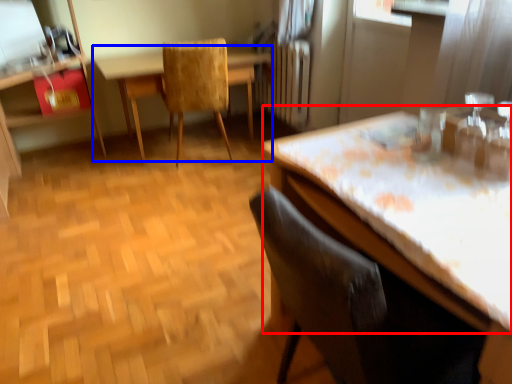
Question: Which object appears farthest to the camera in this image, counter top (highlighted by a red box) or table (highlighted by a blue box)?

Choices:
 (A) counter top
 (B) table

Answer: (B)